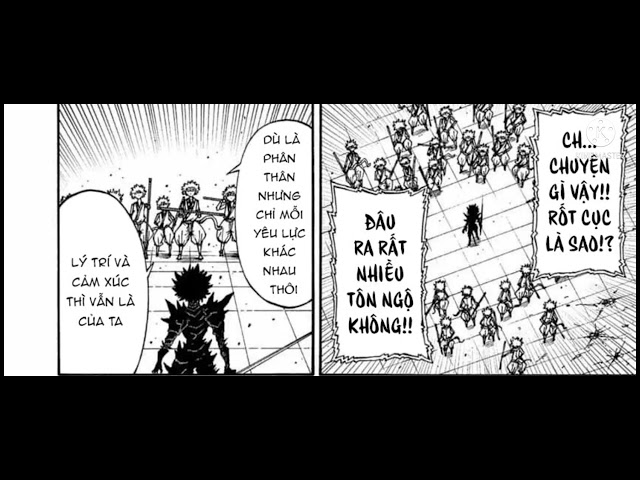
The width and height of the screenshot is (640, 480). I want to click on light in background, so click(177, 158).